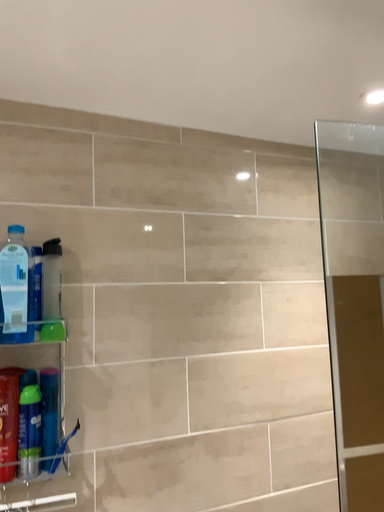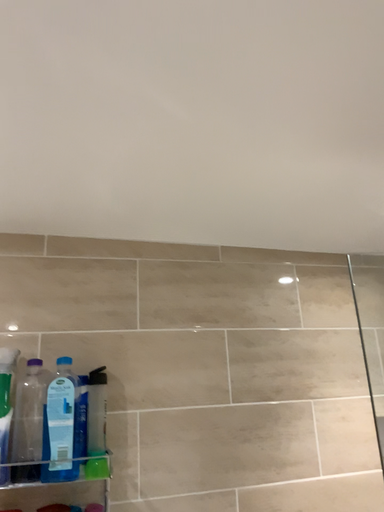
Question: How did the camera likely rotate when shooting the video?

Choices:
 (A) rotated right
 (B) rotated left

Answer: (B)